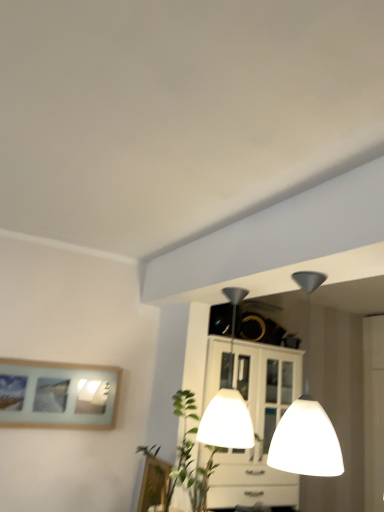
Question: Which direction should I rotate to face white glossy lampshade at center, acting as the first lamp starting from the back, — up or down?

Choices:
 (A) up
 (B) down

Answer: (B)

Question: Can you confirm if white glossy lampshade at upper center, acting as the first lamp starting from the front, is positioned to the right of wooden framed picture at left, positioned as the 1th picture frame in top-to-bottom order?

Choices:
 (A) yes
 (B) no

Answer: (A)

Question: Does white glossy lampshade at upper center, marked as the second lamp in a back-to-front arrangement, have a greater height compared to wooden framed picture at left, positioned as the 1th picture frame in top-to-bottom order?

Choices:
 (A) no
 (B) yes

Answer: (B)

Question: Considering the relative sizes of white glossy lampshade at upper center, marked as the second lamp in a back-to-front arrangement, and wooden framed picture at left, the 2th picture frame ordered from the bottom, in the image provided, is white glossy lampshade at upper center, marked as the second lamp in a back-to-front arrangement, wider than wooden framed picture at left, the 2th picture frame ordered from the bottom,?

Choices:
 (A) no
 (B) yes

Answer: (B)

Question: Can you confirm if white glossy lampshade at upper center, marked as the second lamp in a back-to-front arrangement, is positioned to the left of wooden framed picture at left, marked as the 2th picture frame in a right-to-left arrangement?

Choices:
 (A) yes
 (B) no

Answer: (B)

Question: Is there a large distance between white glossy lampshade at upper center, marked as the second lamp in a back-to-front arrangement, and wooden framed picture at left, marked as the 2th picture frame in a right-to-left arrangement?

Choices:
 (A) no
 (B) yes

Answer: (B)

Question: From the image's perspective, does white glossy lampshade at upper center, acting as the first lamp starting from the front, appear higher than wooden framed picture at left, the first picture frame viewed from the left?

Choices:
 (A) no
 (B) yes

Answer: (B)

Question: From the image's perspective, would you say wooden picture frame at lower center, the 2th picture frame from the top, is positioned over white glossy lampshade at upper center, marked as the second lamp in a back-to-front arrangement?

Choices:
 (A) yes
 (B) no

Answer: (B)

Question: Can you confirm if wooden picture frame at lower center, the first picture frame in the bottom-to-top sequence, is positioned to the right of white glossy lampshade at upper center, marked as the second lamp in a back-to-front arrangement?

Choices:
 (A) no
 (B) yes

Answer: (A)

Question: From the image's perspective, is wooden picture frame at lower center, arranged as the first picture frame when viewed from the right, under white glossy lampshade at upper center, marked as the second lamp in a back-to-front arrangement?

Choices:
 (A) yes
 (B) no

Answer: (A)

Question: Could white glossy lampshade at upper center, marked as the second lamp in a back-to-front arrangement, be considered to be inside wooden picture frame at lower center, the 2th picture frame from the top?

Choices:
 (A) yes
 (B) no

Answer: (B)

Question: Is wooden picture frame at lower center, the 2th picture frame in the left-to-right sequence, smaller than white glossy lampshade at upper center, marked as the second lamp in a back-to-front arrangement?

Choices:
 (A) yes
 (B) no

Answer: (A)

Question: Is wooden picture frame at lower center, the first picture frame in the bottom-to-top sequence, in front of white glossy lampshade at upper center, marked as the second lamp in a back-to-front arrangement?

Choices:
 (A) yes
 (B) no

Answer: (B)

Question: Can you confirm if white glossy lampshade at upper center, marked as the second lamp in a back-to-front arrangement, is positioned to the left of white glossy lampshade at center, which is the 2th lamp in front-to-back order?

Choices:
 (A) no
 (B) yes

Answer: (A)